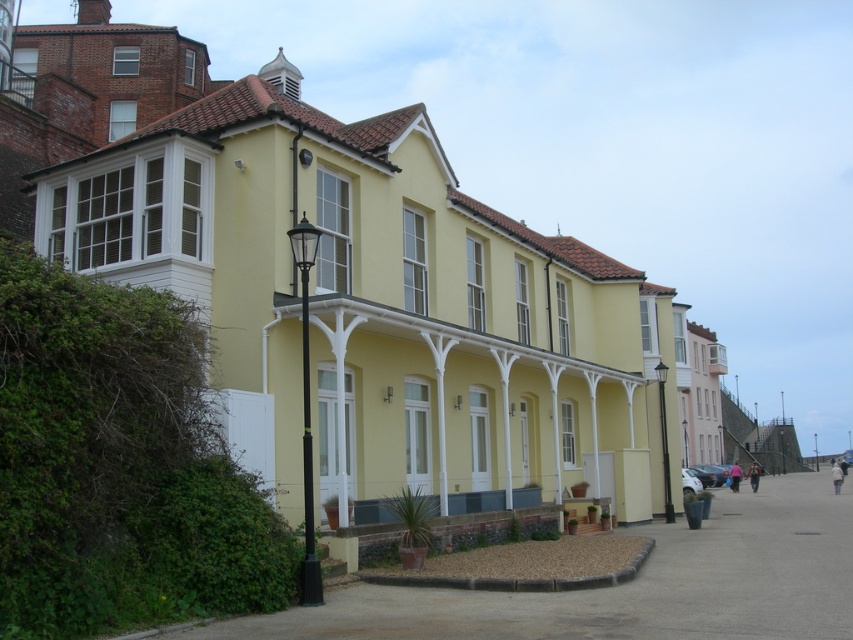
Question: Which point is closer to the camera taking this photo?

Choices:
 (A) (317, 568)
 (B) (660, 385)

Answer: (A)

Question: Can you confirm if black metal/wooden pole at center is smaller than black metal lamp post at center-right?

Choices:
 (A) no
 (B) yes

Answer: (B)

Question: Among these objects, which one is nearest to the camera?

Choices:
 (A) black metal lamp post at center-right
 (B) black metal/wooden pole at center

Answer: (B)

Question: Does black metal/wooden pole at center have a smaller size compared to black metal lamp post at center-right?

Choices:
 (A) yes
 (B) no

Answer: (A)

Question: Which point is closer to the camera taking this photo?

Choices:
 (A) (664, 444)
 (B) (308, 525)

Answer: (B)

Question: Is black metal/wooden pole at center positioned behind black metal lamp post at center-right?

Choices:
 (A) no
 (B) yes

Answer: (A)